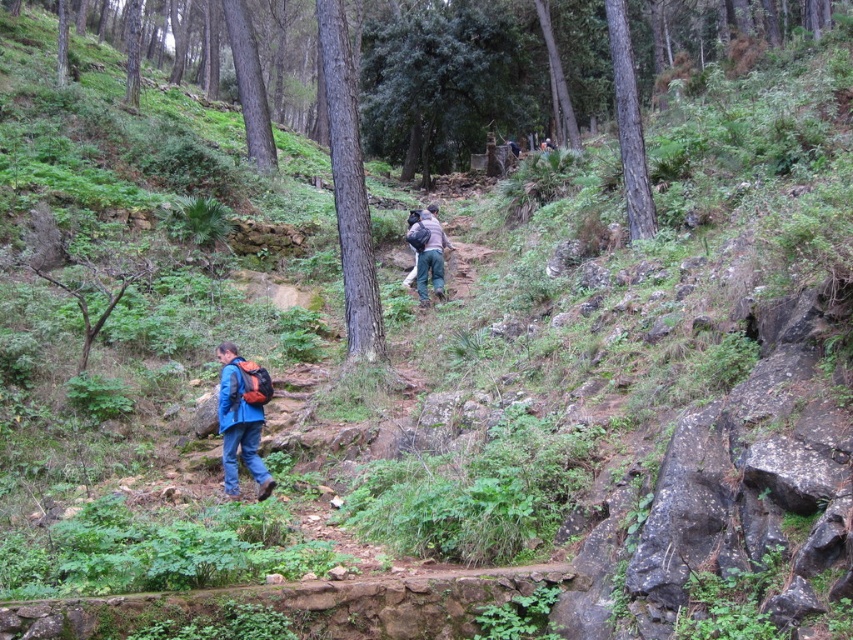
Who is positioned more to the left, matte blue jacket at lower left or dark brown backpack at center?

Positioned to the left is matte blue jacket at lower left.

Measure the distance between point (231, 490) and camera.

Point (231, 490) is 9.70 meters away from camera.

Describe the element at coordinates (239, 426) in the screenshot. I see `matte blue jacket at lower left` at that location.

Where is `matte blue jacket at lower left`? This screenshot has height=640, width=853. matte blue jacket at lower left is located at coordinates (239, 426).